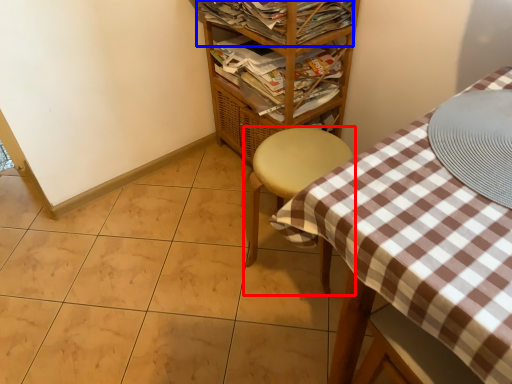
Question: Which object appears farthest to the camera in this image, furniture (highlighted by a red box) or magazine (highlighted by a blue box)?

Choices:
 (A) furniture
 (B) magazine

Answer: (B)